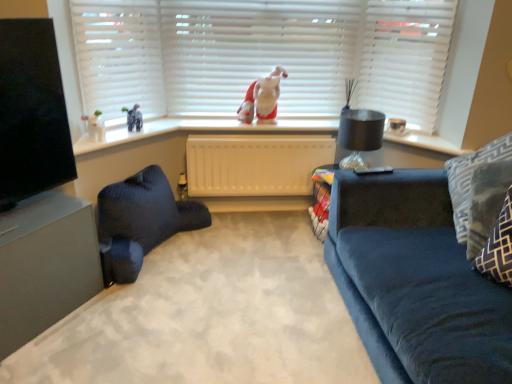
This screenshot has height=384, width=512. Find the location of `free spot in front of dark blue fabric studio couch at lower left, the 2th studio couch in the right-to-left sequence`. free spot in front of dark blue fabric studio couch at lower left, the 2th studio couch in the right-to-left sequence is located at coordinates (153, 309).